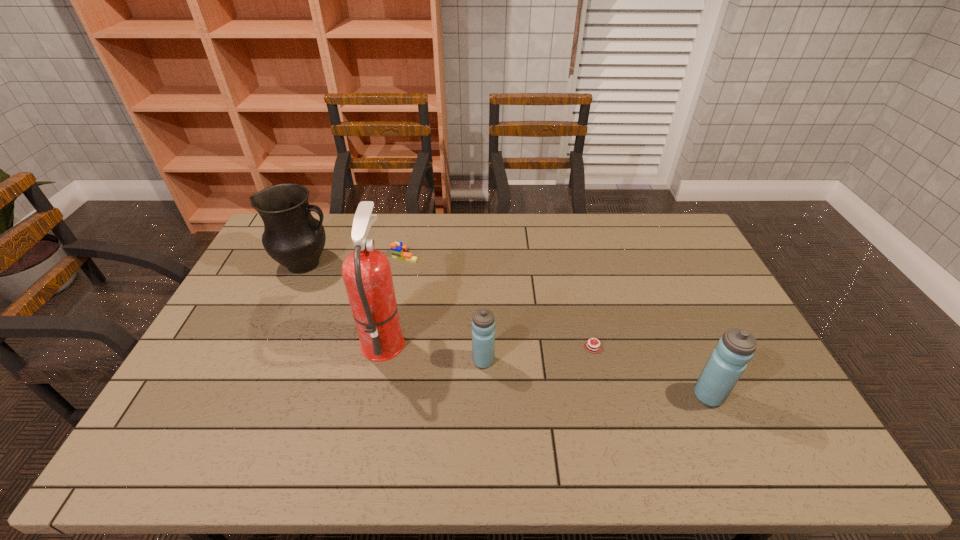
Where is `free space located on the left of the right water bottle`? The image size is (960, 540). free space located on the left of the right water bottle is located at coordinates (621, 396).

Where is `free space located on the right of the Lego`? The image size is (960, 540). free space located on the right of the Lego is located at coordinates (451, 255).

Find the location of a particular element. The height and width of the screenshot is (540, 960). vacant region located 0.220m on the handle side of the pitcher is located at coordinates (398, 264).

The width and height of the screenshot is (960, 540). I want to click on free region located on the back of the fifth object from left to right, so click(x=585, y=314).

The height and width of the screenshot is (540, 960). Find the location of `vacant space located 0.360m with the handle and hose on the tallest object`. vacant space located 0.360m with the handle and hose on the tallest object is located at coordinates (528, 339).

Image resolution: width=960 pixels, height=540 pixels. Find the location of `Lego located at the far edge`. Lego located at the far edge is located at coordinates (398, 250).

At what (x,y) coordinates should I click in order to perform the action: click on pitcher at the far edge. Please return your answer as a coordinate pair (x, y). The height and width of the screenshot is (540, 960). Looking at the image, I should click on pos(292,236).

Locate an element on the screen. The width and height of the screenshot is (960, 540). object at the near edge is located at coordinates (728, 361).

Locate an element on the screen. Image resolution: width=960 pixels, height=540 pixels. object that is at the left edge is located at coordinates (292, 236).

The width and height of the screenshot is (960, 540). I want to click on object that is positioned at the right edge, so click(728, 361).